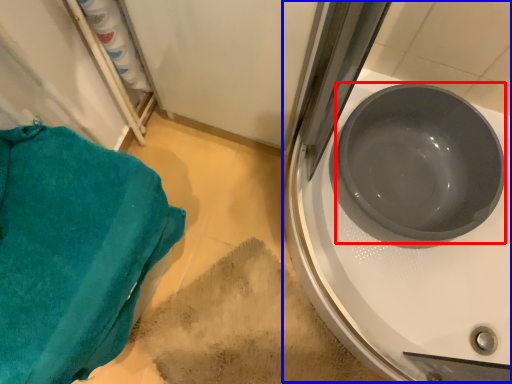
Question: Which object is closer to the camera taking this photo, basin (highlighted by a red box) or sink (highlighted by a blue box)?

Choices:
 (A) basin
 (B) sink

Answer: (B)